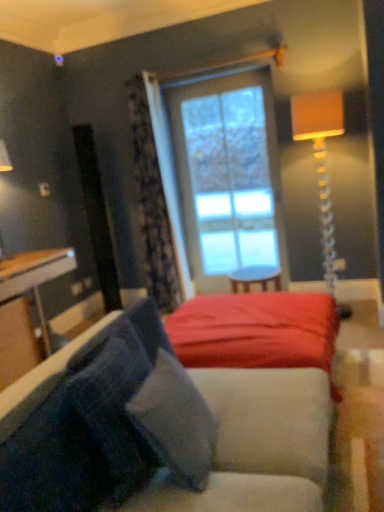
This screenshot has width=384, height=512. What do you see at coordinates (321, 159) in the screenshot?
I see `orange fabric lampshade at upper right` at bounding box center [321, 159].

What do you see at coordinates (255, 277) in the screenshot?
I see `wooden round table at center, arranged as the first table when viewed from the right` at bounding box center [255, 277].

What is the approximate width of patterned fabric curtain at upper center?

patterned fabric curtain at upper center is 13.90 inches wide.

The width and height of the screenshot is (384, 512). I want to click on velvety blue pillow at lower left, acting as the first pillow starting from the left, so point(113,405).

Find the location of a particular element. This screenshot has height=512, width=384. smooth red fabric bed at center is located at coordinates pos(256,331).

The width and height of the screenshot is (384, 512). Find the location of `velvety gray pillow at lower left, which is the second pillow from left to right`. velvety gray pillow at lower left, which is the second pillow from left to right is located at coordinates (175, 422).

Considering the relative sizes of smooth red fabric bed at center and wooden table at left, the 2th table viewed from the right, in the image provided, is smooth red fabric bed at center wider than wooden table at left, the 2th table viewed from the right,?

Yes, smooth red fabric bed at center is wider than wooden table at left, the 2th table viewed from the right.

Visually, is smooth red fabric bed at center positioned to the left or to the right of wooden table at left, placed as the first table when sorted from left to right?

Clearly, smooth red fabric bed at center is on the right of wooden table at left, placed as the first table when sorted from left to right, in the image.

How different are the orientations of smooth red fabric bed at center and wooden table at left, the 2th table viewed from the right, in degrees?

0.065 degrees.

You are a GUI agent. You are given a task and a screenshot of the screen. Output one action in this format:
    pyautogui.click(x=<x>, y=<y>)
    Task: Click on the 2nd table behind when counting from the smooth red fabric bed at center
    
    Given the screenshot: What is the action you would take?
    pyautogui.click(x=255, y=277)

Considering the points (234, 302) and (233, 273), which point is in front, point (234, 302) or point (233, 273)?

The point (234, 302) is more forward.

From the image's perspective, which one is positioned higher, smooth red fabric bed at center or wooden round table at center, arranged as the first table when viewed from the right?

wooden round table at center, arranged as the first table when viewed from the right, is shown above in the image.

Does patterned fabric curtain at upper center come behind wooden round table at center, the 2th table in the left-to-right sequence?

Yes, it is.

Are patterned fabric curtain at upper center and wooden round table at center, arranged as the first table when viewed from the right, far apart?

Yes, patterned fabric curtain at upper center and wooden round table at center, arranged as the first table when viewed from the right, are quite far apart.

Does patterned fabric curtain at upper center appear on the right side of wooden round table at center, arranged as the first table when viewed from the right?

No, patterned fabric curtain at upper center is not to the right of wooden round table at center, arranged as the first table when viewed from the right.

Looking at this image, is patterned fabric curtain at upper center bigger than wooden round table at center, the 2th table in the left-to-right sequence?

Yes.

From a real-world perspective, which object stands above the other?

clear glass window at center, from a real-world perspective.

Considering the sizes of velvety blue pillow at lower left, which ranks as the 2th pillow in right-to-left order, and clear glass window at center in the image, is velvety blue pillow at lower left, which ranks as the 2th pillow in right-to-left order, taller or shorter than clear glass window at center?

In the image, velvety blue pillow at lower left, which ranks as the 2th pillow in right-to-left order, appears to be shorter than clear glass window at center.

Is there a large distance between velvety blue pillow at lower left, acting as the first pillow starting from the left, and clear glass window at center?

velvety blue pillow at lower left, acting as the first pillow starting from the left, is far away from clear glass window at center.

Is clear glass window at center looking in the opposite direction of smooth red fabric bed at center?

No, clear glass window at center's orientation is not away from smooth red fabric bed at center.

From the image's perspective, would you say clear glass window at center is positioned over smooth red fabric bed at center?

Yes, from the image's perspective, clear glass window at center is on top of smooth red fabric bed at center.

Considering the relative positions of clear glass window at center and smooth red fabric bed at center in the image provided, is clear glass window at center to the left of smooth red fabric bed at center from the viewer's perspective?

No.

From a real-world perspective, who is located higher, clear glass window at center or smooth red fabric bed at center?

In real-world perspective, clear glass window at center is above.

Are patterned fabric curtain at upper center and velvety gray pillow at lower left, which is the second pillow from left to right, beside each other?

patterned fabric curtain at upper center is not next to velvety gray pillow at lower left, which is the second pillow from left to right, and they're not touching.

Could you tell me if patterned fabric curtain at upper center is turned towards velvety gray pillow at lower left, which is the second pillow from left to right?

No, patterned fabric curtain at upper center is not turned towards velvety gray pillow at lower left, which is the second pillow from left to right.

Considering the sizes of objects patterned fabric curtain at upper center and velvety gray pillow at lower left, the first pillow when ordered from right to left, in the image provided, who is smaller, patterned fabric curtain at upper center or velvety gray pillow at lower left, the first pillow when ordered from right to left,?

velvety gray pillow at lower left, the first pillow when ordered from right to left.

Which object is positioned more to the left, wooden round table at center, arranged as the first table when viewed from the right, or orange fabric lampshade at upper right?

wooden round table at center, arranged as the first table when viewed from the right.

Which object is further away from the camera taking this photo, wooden round table at center, the 2th table in the left-to-right sequence, or orange fabric lampshade at upper right?

wooden round table at center, the 2th table in the left-to-right sequence, is further away from the camera.

Are wooden round table at center, arranged as the first table when viewed from the right, and orange fabric lampshade at upper right beside each other?

No, wooden round table at center, arranged as the first table when viewed from the right, is not beside orange fabric lampshade at upper right.

The height and width of the screenshot is (512, 384). Identify the location of bed below the wooden table at left, placed as the first table when sorted from left to right (from the image's perspective). (256, 331).

Locate an element on the screen. The image size is (384, 512). bed below the wooden round table at center, the 2th table in the left-to-right sequence (from a real-world perspective) is located at coordinates (256, 331).

In the scene shown: Based on their spatial positions, is clear glass window at center or wooden round table at center, arranged as the first table when viewed from the right, further from velvety gray pillow at lower left, which is the second pillow from left to right?

Based on the image, clear glass window at center appears to be further to velvety gray pillow at lower left, which is the second pillow from left to right.

When comparing their distances from clear glass window at center, does smooth red fabric bed at center or velvety gray pillow at lower left, the first pillow when ordered from right to left, seem further?

velvety gray pillow at lower left, the first pillow when ordered from right to left, is positioned further to the anchor clear glass window at center.

Estimate the real-world distances between objects in this image. Which object is closer to velvety blue pillow at lower left, which ranks as the 2th pillow in right-to-left order, velvety gray pillow at lower left, which is the second pillow from left to right, or wooden round table at center, arranged as the first table when viewed from the right?

velvety gray pillow at lower left, which is the second pillow from left to right, lies closer to velvety blue pillow at lower left, which ranks as the 2th pillow in right-to-left order, than the other object.

Considering their positions, is velvety gray pillow at lower left, the first pillow when ordered from right to left, positioned further to velvety blue pillow at lower left, acting as the first pillow starting from the left, than orange fabric lampshade at upper right?

orange fabric lampshade at upper right is further to velvety blue pillow at lower left, acting as the first pillow starting from the left.

Based on their spatial positions, is wooden table at left, placed as the first table when sorted from left to right, or wooden round table at center, arranged as the first table when viewed from the right, further from velvety gray pillow at lower left, which is the second pillow from left to right?

Among the two, wooden round table at center, arranged as the first table when viewed from the right, is located further to velvety gray pillow at lower left, which is the second pillow from left to right.

Estimate the real-world distances between objects in this image. Which object is closer to patterned fabric curtain at upper center, velvety gray pillow at lower left, which is the second pillow from left to right, or clear glass window at center?

clear glass window at center.

Estimate the real-world distances between objects in this image. Which object is closer to velvety gray pillow at lower left, the first pillow when ordered from right to left, wooden table at left, placed as the first table when sorted from left to right, or velvety blue pillow at lower left, acting as the first pillow starting from the left?

velvety blue pillow at lower left, acting as the first pillow starting from the left, is positioned closer to the anchor velvety gray pillow at lower left, the first pillow when ordered from right to left.

Based on the photo, looking at the image, which one is located further to wooden round table at center, the 2th table in the left-to-right sequence, wooden table at left, the 2th table viewed from the right, or smooth red fabric bed at center?

The object further to wooden round table at center, the 2th table in the left-to-right sequence, is wooden table at left, the 2th table viewed from the right.

Where is `pillow located between velvety blue pillow at lower left, acting as the first pillow starting from the left, and wooden round table at center, arranged as the first table when viewed from the right, in the depth direction`? The width and height of the screenshot is (384, 512). pillow located between velvety blue pillow at lower left, acting as the first pillow starting from the left, and wooden round table at center, arranged as the first table when viewed from the right, in the depth direction is located at coordinates (175, 422).

I want to click on bed positioned between velvety gray pillow at lower left, the first pillow when ordered from right to left, and patterned fabric curtain at upper center from near to far, so click(256, 331).

You are a GUI agent. You are given a task and a screenshot of the screen. Output one action in this format:
    pyautogui.click(x=<x>, y=<y>)
    Task: Click on the pillow positioned between velvety blue pillow at lower left, acting as the first pillow starting from the left, and orange fabric lampshade at upper right from near to far
    The width and height of the screenshot is (384, 512).
    Given the screenshot: What is the action you would take?
    pyautogui.click(x=175, y=422)

This screenshot has width=384, height=512. I want to click on pillow located between velvety blue pillow at lower left, acting as the first pillow starting from the left, and clear glass window at center in the depth direction, so click(175, 422).